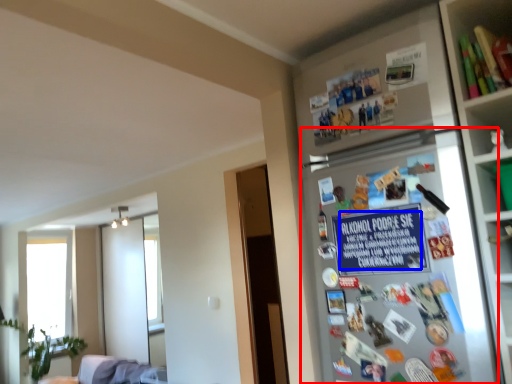
Question: Which object appears closest to the camera in this image, fridge (highlighted by a red box) or writing (highlighted by a blue box)?

Choices:
 (A) fridge
 (B) writing

Answer: (A)